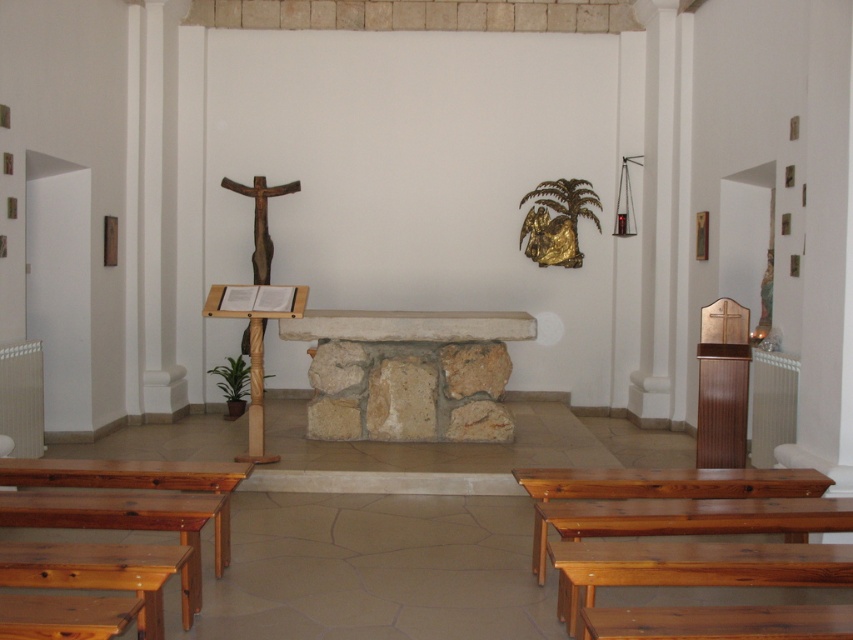
Question: Which object is positioned closest to the wooden crucifix at left?

Choices:
 (A) natural wood bench at lower left
 (B) shiny brown wood bench at lower right

Answer: (A)

Question: Does natural wood bench at lower left have a lesser width compared to shiny brown wood bench at lower right?

Choices:
 (A) no
 (B) yes

Answer: (B)

Question: Which is farther from the shiny brown wood bench at lower right?

Choices:
 (A) wooden crucifix at left
 (B) natural wood bench at lower left

Answer: (A)

Question: Can you confirm if natural wood bench at lower left is positioned to the left of shiny brown wood bench at lower right?

Choices:
 (A) yes
 (B) no

Answer: (A)

Question: Which object appears closest to the camera in this image?

Choices:
 (A) natural wood bench at lower left
 (B) shiny brown wood bench at lower right
 (C) wooden crucifix at left

Answer: (A)

Question: Does natural wood bench at lower left appear on the left side of wooden crucifix at left?

Choices:
 (A) yes
 (B) no

Answer: (B)